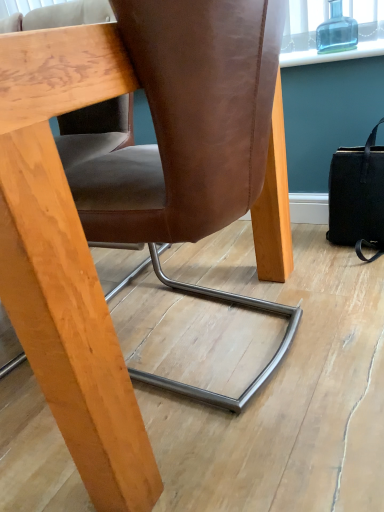
Question: Is brown leather chair at center taller than black leather handbag at right?

Choices:
 (A) yes
 (B) no

Answer: (A)

Question: Considering the relative positions of brown leather chair at center and black leather handbag at right in the image provided, is brown leather chair at center to the left of black leather handbag at right from the viewer's perspective?

Choices:
 (A) no
 (B) yes

Answer: (B)

Question: Can you confirm if brown leather chair at center is shorter than black leather handbag at right?

Choices:
 (A) yes
 (B) no

Answer: (B)

Question: Is brown leather chair at center further to camera compared to black leather handbag at right?

Choices:
 (A) no
 (B) yes

Answer: (A)

Question: From the image's perspective, is brown leather chair at center above black leather handbag at right?

Choices:
 (A) yes
 (B) no

Answer: (B)

Question: Considering the positions of point (182, 69) and point (352, 239), is point (182, 69) closer or farther from the camera than point (352, 239)?

Choices:
 (A) farther
 (B) closer

Answer: (B)

Question: Looking at the image, does brown leather chair at center seem bigger or smaller compared to black leather handbag at right?

Choices:
 (A) big
 (B) small

Answer: (A)

Question: From the image's perspective, relative to black leather handbag at right, is brown leather chair at center above or below?

Choices:
 (A) below
 (B) above

Answer: (A)

Question: Is brown leather chair at center situated inside black leather handbag at right or outside?

Choices:
 (A) outside
 (B) inside

Answer: (A)

Question: Is transparent glass bottle at upper right situated inside black leather handbag at right or outside?

Choices:
 (A) outside
 (B) inside

Answer: (A)

Question: Looking at the image, does transparent glass bottle at upper right seem bigger or smaller compared to black leather handbag at right?

Choices:
 (A) big
 (B) small

Answer: (B)

Question: Considering their positions, is transparent glass bottle at upper right located in front of or behind black leather handbag at right?

Choices:
 (A) front
 (B) behind

Answer: (B)

Question: Considering the positions of transparent glass bottle at upper right and black leather handbag at right in the image, is transparent glass bottle at upper right wider or thinner than black leather handbag at right?

Choices:
 (A) thin
 (B) wide

Answer: (A)

Question: From the image's perspective, is transparent glass bottle at upper right located above or below brown leather chair at center?

Choices:
 (A) below
 (B) above

Answer: (B)

Question: Looking at their shapes, would you say transparent glass bottle at upper right is wider or thinner than brown leather chair at center?

Choices:
 (A) wide
 (B) thin

Answer: (B)